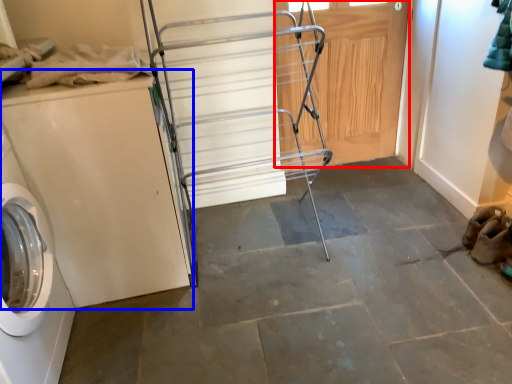
Question: Which of the following is the closest to the observer, door (highlighted by a red box) or washing machine (highlighted by a blue box)?

Choices:
 (A) door
 (B) washing machine

Answer: (B)